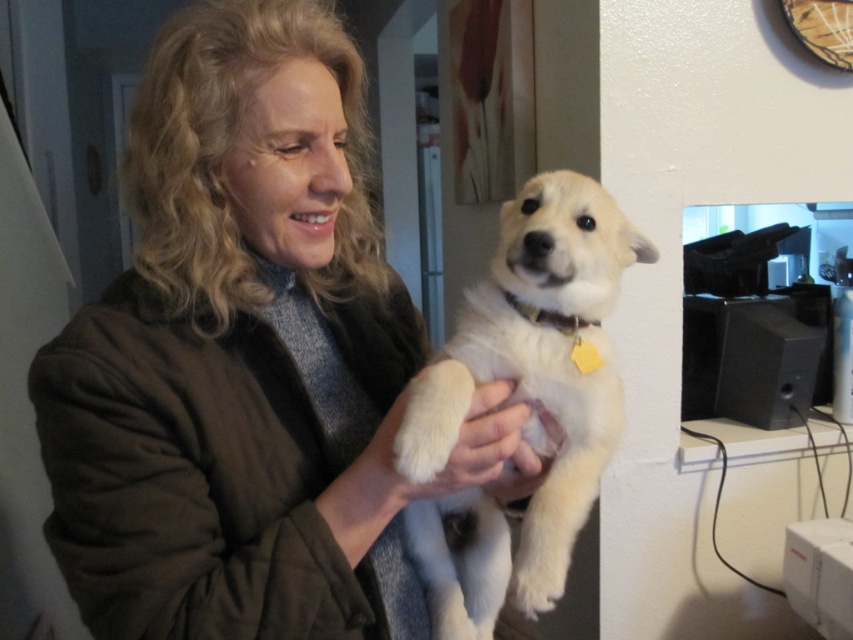
You are a delivery robot that needs to place a package between the matte brown jacket at center and the white fluffy dog at center. The package is 5 inches wide. Can you fit it between them?

The distance between the matte brown jacket at center and the white fluffy dog at center is 6.03 inches. Since the package is 5 inches wide, it can fit between them as there is enough space.

You are standing in a room and want to hand a small gift to the person wearing the matte brown jacket at center without moving closer. The gift is 12 inches long. Can you reach them from your current position?

The distance between you and the matte brown jacket at center is 26.28 inches. Since the gift is 12 inches long, you can extend your arm to reach them without moving closer.

You are a tailor measuring garments for alterations. You need to determine if the matte brown jacket at center can fit over the white fluffy dog at center. Based on their sizes, is this possible?

The matte brown jacket at center is larger in size than the white fluffy dog at center, so it is possible that the matte brown jacket at center can fit over the white fluffy dog at center.